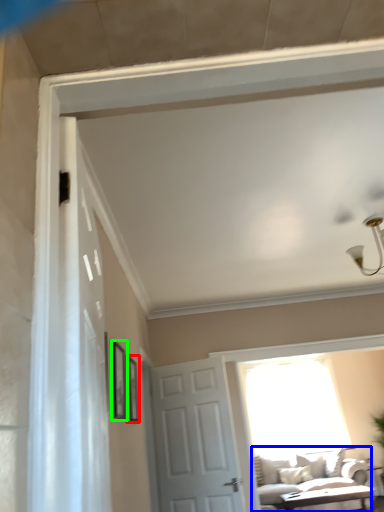
Question: Which is farther away from picture frame (highlighted by a red box)? studio couch (highlighted by a blue box) or picture frame (highlighted by a green box)?

Choices:
 (A) studio couch
 (B) picture frame

Answer: (A)